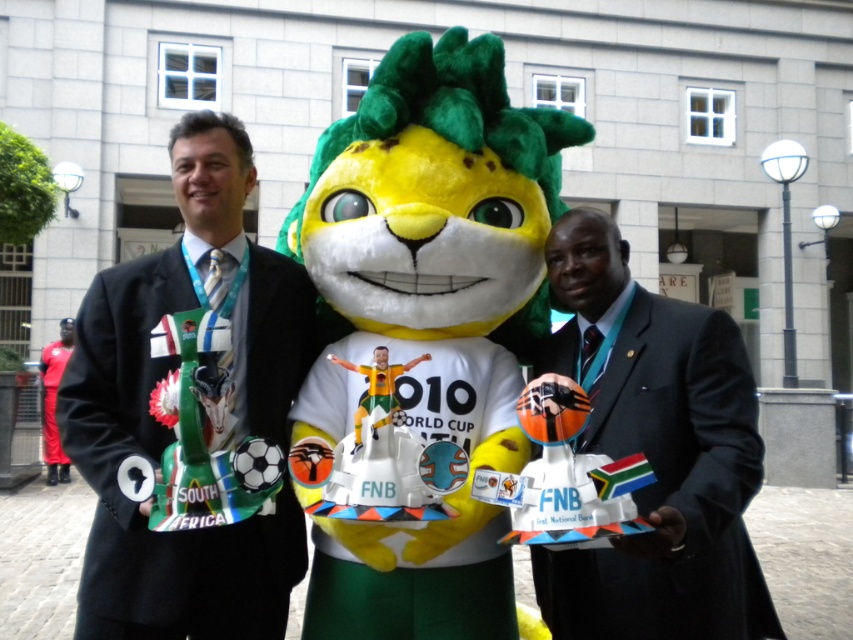
Question: Which object is positioned farthest from the dark gray suit at center?

Choices:
 (A) matte black suit at center
 (B) soft plush lion at center

Answer: (A)

Question: From the image, what is the correct spatial relationship of soft plush lion at center in relation to dark gray suit at center?

Choices:
 (A) left
 (B) right

Answer: (A)

Question: Which object is the farthest from the dark gray suit at center?

Choices:
 (A) matte black suit at center
 (B) soft plush lion at center

Answer: (A)

Question: Is the position of soft plush lion at center less distant than that of dark gray suit at center?

Choices:
 (A) yes
 (B) no

Answer: (B)

Question: Does soft plush lion at center come in front of dark gray suit at center?

Choices:
 (A) no
 (B) yes

Answer: (A)

Question: Which is nearer to the soft plush lion at center?

Choices:
 (A) matte black suit at center
 (B) dark gray suit at center

Answer: (A)